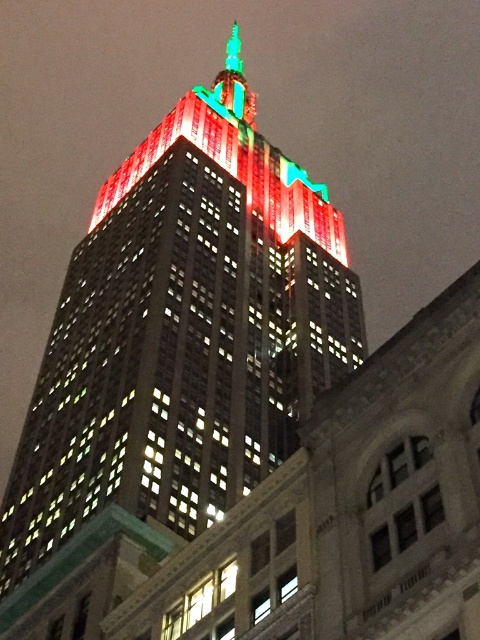
You are standing in the middle of the city at night and see the point marked at coordinates (182, 339). What does this point represent?

The point at coordinates (182, 339) represents the location of the matte glass skyscraper at center.

You are a drone operator trying to capture a photo of the matte glass skyscraper at center. Your drone is currently at point 0.5, 0.4. Can you determine if you need to move the drone north or south to align it with the skyscraper?

The matte glass skyscraper at center is located at point (182, 339). Since your drone is at (192, 320), you need to move it south to align with the skyscraper because the skyscraper is positioned lower on the y axis than the drone.

You are standing at the base of the skyscraper and looking up at the two points marked in the image. Which point, point (132, 353) or point (226, 84), appears closer to you?

Point (132, 353) is in front of point (226, 84), so it appears closer to you.